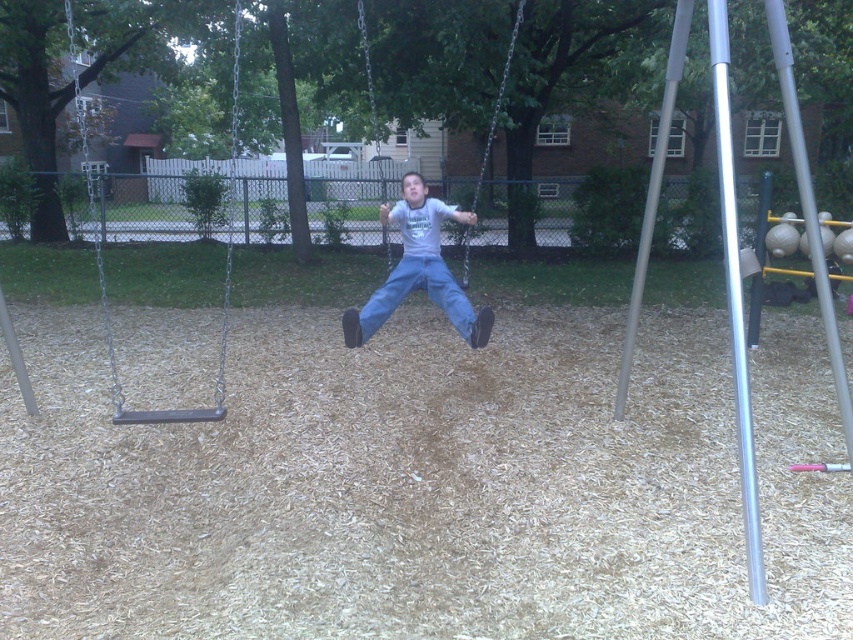
Question: Among these objects, which one is farthest from the camera?

Choices:
 (A) metallic swing at left
 (B) light blue jeans at center
 (C) blue denim jeans at center

Answer: (C)

Question: Which point appears closest to the camera in this image?

Choices:
 (A) (409, 182)
 (B) (430, 269)

Answer: (B)

Question: Is light blue jeans at center wider than metallic swing at left?

Choices:
 (A) no
 (B) yes

Answer: (A)

Question: Which point appears closest to the camera in this image?

Choices:
 (A) (73, 28)
 (B) (444, 301)

Answer: (B)

Question: Can you confirm if light blue jeans at center is bigger than metallic swing at left?

Choices:
 (A) no
 (B) yes

Answer: (A)

Question: Can you confirm if light blue jeans at center is smaller than blue denim jeans at center?

Choices:
 (A) no
 (B) yes

Answer: (A)